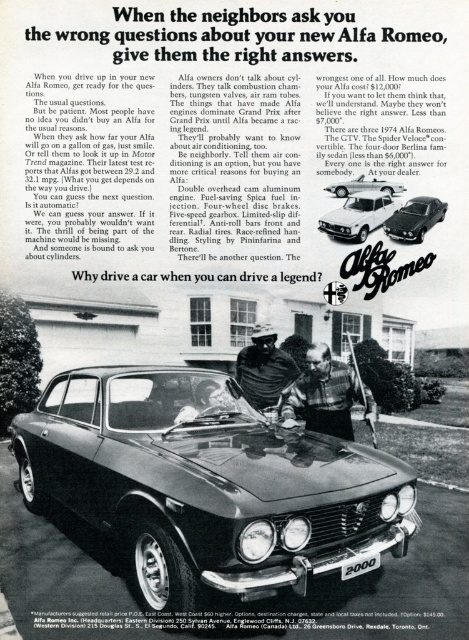
You are a car salesman who wants to highlight the size difference between the metallic silver sedan at center and the shiny black sedan at center to a potential buyer. How would you describe their sizes?

The metallic silver sedan at center is larger in size than the shiny black sedan at center, so it offers more space and comfort for passengers and cargo.

From the picture: In the vintage Alfa Romeo advertisement, there is a metallic silver sedan at center and a dark blue leather jacket at center. Which object appears taller in the image?

The metallic silver sedan at center is much taller than the dark blue leather jacket at center.